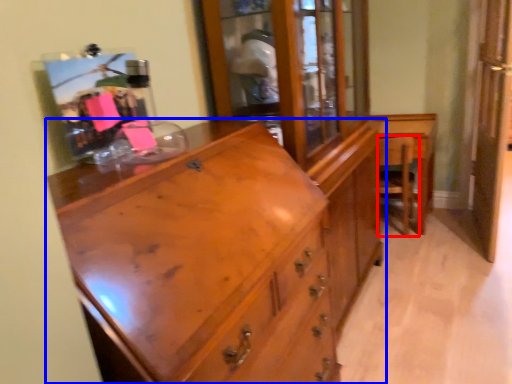
Question: Which object appears closest to the camera in this image, armchair (highlighted by a red box) or chest of drawers (highlighted by a blue box)?

Choices:
 (A) armchair
 (B) chest of drawers

Answer: (B)